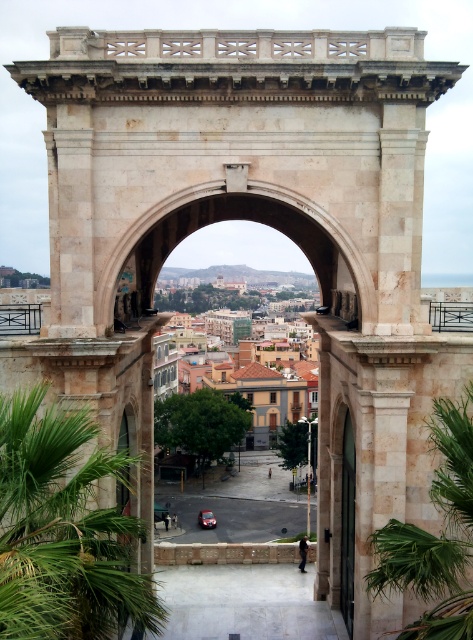
You are a photographer planning to capture a shot of the green leafy palm at right and the shiny red car at center through the grand stone archway. Which object will appear taller in your photo?

The green leafy palm at right is taller than the shiny red car at center, so it will appear taller in the photo.

You are standing in front of the grand stone archway and want to determine the relative positions of two points marked in the image. Which point, point 1 at coordinates point (16, 490) or point 2 at coordinates point (210, 513), is closer to you?

Point 1 at coordinates point (16, 490) is closer to the viewer than point 2 at coordinates point (210, 513).

You are a tourist standing at the base of the grand stone archway and want to take a photo that includes both the green leafy palm tree at left and the shiny red car at center. Which object will appear larger in your photo?

The green leafy palm tree at left will appear larger in the photo because it is bigger than the shiny red car at center.